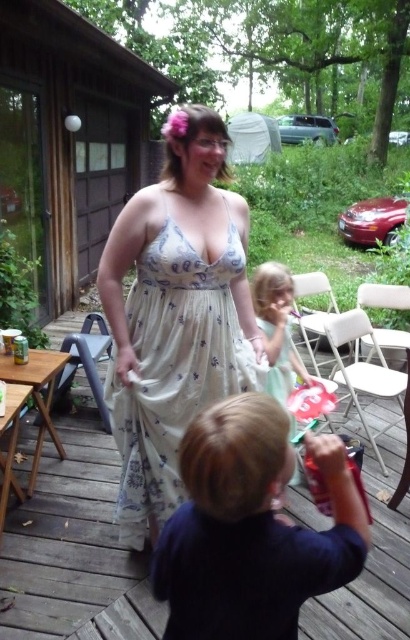
Question: Does dark blue shirt at lower center lie behind white floral dress at center?

Choices:
 (A) no
 (B) yes

Answer: (A)

Question: Which point is farther to the camera?

Choices:
 (A) (275, 376)
 (B) (36, 497)
 (C) (136, 467)
 (D) (343, 493)

Answer: (B)

Question: Which point is closer to the camera?

Choices:
 (A) (334, 508)
 (B) (138, 525)
 (C) (277, 317)

Answer: (A)

Question: Does dark blue shirt at lower center have a lesser width compared to white floral dress at center?

Choices:
 (A) yes
 (B) no

Answer: (A)

Question: Is wooden deck at center above dark blue shirt at lower center?

Choices:
 (A) no
 (B) yes

Answer: (A)

Question: Which object appears closest to the camera in this image?

Choices:
 (A) wooden deck at center
 (B) dark blue shirt at lower center

Answer: (B)